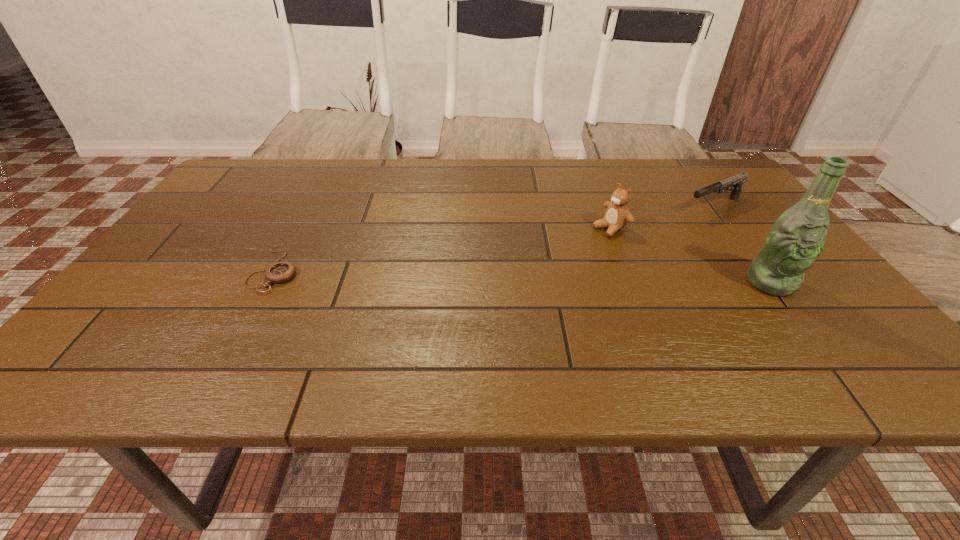
Find the location of `free region located 0.120m on the front-facing side of the teddy bear`. free region located 0.120m on the front-facing side of the teddy bear is located at coordinates (564, 250).

Locate an element on the screen. The image size is (960, 540). free spot located at the muzzle end of the gun is located at coordinates (583, 256).

You are a GUI agent. You are given a task and a screenshot of the screen. Output one action in this format:
    pyautogui.click(x=<x>, y=<y>)
    Task: Click on the vacant space located 0.210m at the muzzle end of the gun
    
    Given the screenshot: What is the action you would take?
    pyautogui.click(x=636, y=235)

Find the location of a particular element. vacant space located at the muzzle end of the gun is located at coordinates (667, 222).

At what (x,y) coordinates should I click in order to perform the action: click on object located at the far edge. Please return your answer as a coordinate pair (x, y). Image resolution: width=960 pixels, height=540 pixels. Looking at the image, I should click on (736, 182).

The width and height of the screenshot is (960, 540). I want to click on beer bottle present at the right edge, so 797,237.

Where is `gun that is at the right edge`? Image resolution: width=960 pixels, height=540 pixels. gun that is at the right edge is located at coordinates (736, 182).

Find the location of a particular element. Image resolution: width=960 pixels, height=540 pixels. object at the far right corner is located at coordinates (736, 182).

Identify the location of blank area at the far edge. (666, 174).

Locate an element on the screen. The image size is (960, 540). free spot at the near edge of the desktop is located at coordinates (671, 311).